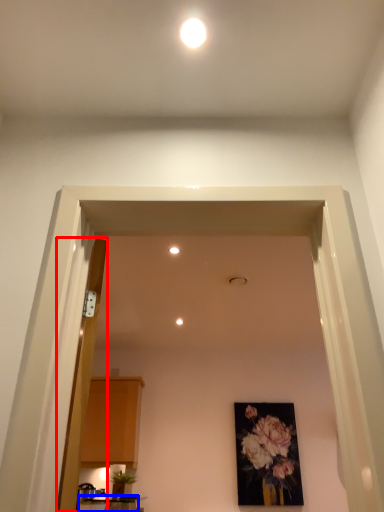
Question: Which of the following is the farthest to the observer, door (highlighted by a red box) or table (highlighted by a blue box)?

Choices:
 (A) door
 (B) table

Answer: (B)